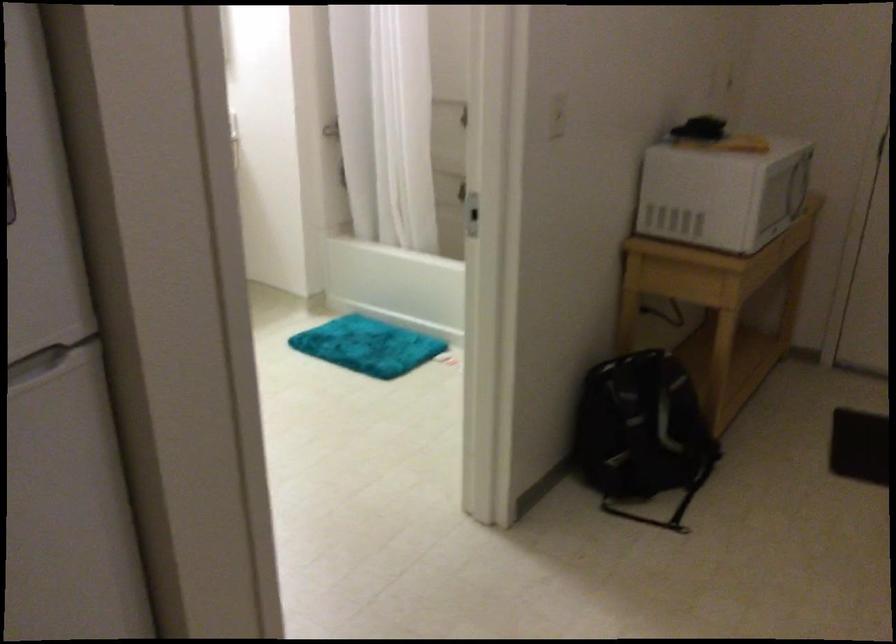
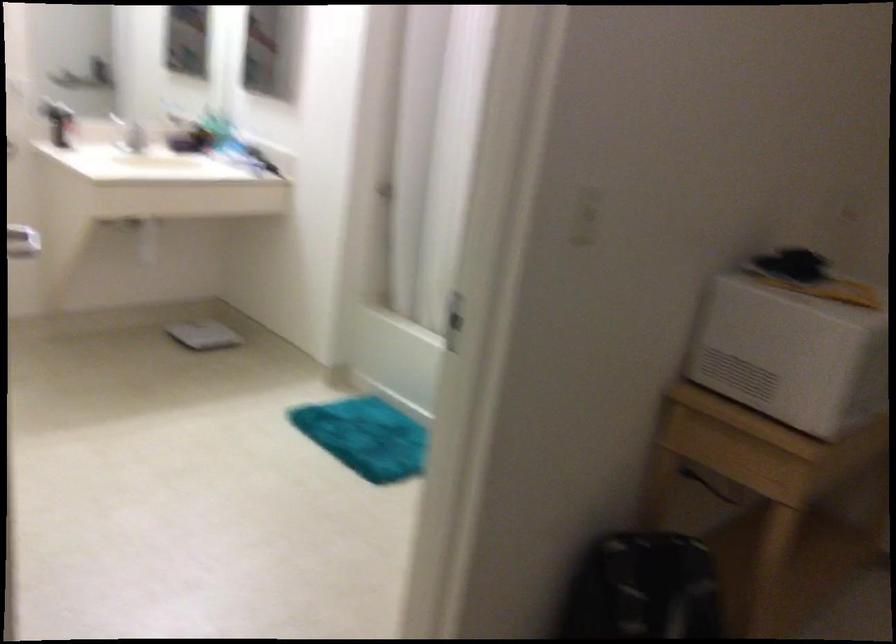
Question: The first image is from the beginning of the video and the second image is from the end. How did the camera likely rotate when shooting the video?

Choices:
 (A) Left
 (B) Right
 (C) Up
 (D) Down

Answer: (A)